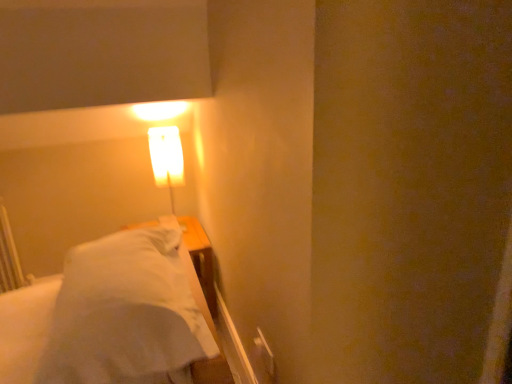
Find the location of a particular element. The width and height of the screenshot is (512, 384). matte white lamp at upper left is located at coordinates (167, 158).

The image size is (512, 384). What do you see at coordinates (167, 158) in the screenshot?
I see `matte white lamp at upper left` at bounding box center [167, 158].

The height and width of the screenshot is (384, 512). Describe the element at coordinates (25, 329) in the screenshot. I see `white soft bed at left` at that location.

This screenshot has width=512, height=384. What are the coordinates of `white soft bed at left` in the screenshot? It's located at (25, 329).

Where is `matte white lamp at upper left`? The image size is (512, 384). matte white lamp at upper left is located at coordinates (167, 158).

Would you say matte white lamp at upper left is to the left or to the right of white soft bed at left in the picture?

Clearly, matte white lamp at upper left is on the left of white soft bed at left in the image.

Considering the positions of objects matte white lamp at upper left and white soft bed at left in the image provided, who is behind, matte white lamp at upper left or white soft bed at left?

matte white lamp at upper left is more distant.

Between point (172, 159) and point (7, 346), which one is positioned in front?

The point (7, 346) is closer to the camera.

In the scene shown: From the image's perspective, does matte white lamp at upper left appear higher than white soft bed at left?

Correct, matte white lamp at upper left appears higher than white soft bed at left in the image.

Consider the image. From a real-world perspective, is matte white lamp at upper left positioned above or below white soft bed at left?

Clearly, from a real-world perspective, matte white lamp at upper left is above white soft bed at left.

Is matte white lamp at upper left wider or thinner than white soft bed at left?

In the image, matte white lamp at upper left appears to be more narrow than white soft bed at left.

Is matte white lamp at upper left taller or shorter than white soft bed at left?

matte white lamp at upper left is taller than white soft bed at left.

Which of these two, matte white lamp at upper left or white soft bed at left, is bigger?

white soft bed at left.

Is matte white lamp at upper left completely or partially outside of white soft bed at left?

Absolutely, matte white lamp at upper left is external to white soft bed at left.

Based on the photo, are matte white lamp at upper left and white soft bed at left far apart?

matte white lamp at upper left is actually quite close to white soft bed at left.

Looking at this image, could you tell me if matte white lamp at upper left is facing white soft bed at left?

No, matte white lamp at upper left is not oriented towards white soft bed at left.

Where is `lamp lying on the left of white soft bed at left`? lamp lying on the left of white soft bed at left is located at coordinates (167, 158).

Does white soft bed at left appear on the left side of matte white lamp at upper left?

Incorrect, white soft bed at left is not on the left side of matte white lamp at upper left.

Is white soft bed at left in front of or behind matte white lamp at upper left in the image?

Visually, white soft bed at left is located in front of matte white lamp at upper left.

Is point (22, 354) positioned in front of point (172, 129)?

Yes, it is.

Consider the image. From the image's perspective, is white soft bed at left on top of matte white lamp at upper left?

No, from the image's perspective, white soft bed at left is not on top of matte white lamp at upper left.

From a real-world perspective, does white soft bed at left sit lower than matte white lamp at upper left?

Yes, from a real-world perspective, white soft bed at left is beneath matte white lamp at upper left.

Which of these two, white soft bed at left or matte white lamp at upper left, is wider?

With larger width is white soft bed at left.

Between white soft bed at left and matte white lamp at upper left, which one has more height?

matte white lamp at upper left is taller.

Between white soft bed at left and matte white lamp at upper left, which one has smaller size?

matte white lamp at upper left.

Is matte white lamp at upper left completely or partially inside white soft bed at left?

No, matte white lamp at upper left is not surrounded by white soft bed at left.

Are white soft bed at left and matte white lamp at upper left beside each other?

No.

Is white soft bed at left positioned with its back to matte white lamp at upper left?

No, white soft bed at left's orientation is not away from matte white lamp at upper left.

At what (x,y) coordinates should I click in order to perform the action: click on bed on the right side of matte white lamp at upper left. Please return your answer as a coordinate pair (x, y). The image size is (512, 384). Looking at the image, I should click on pos(25,329).

Locate an element on the screen. The image size is (512, 384). lamp lying behind the white soft bed at left is located at coordinates (167, 158).

I want to click on bed lying in front of the matte white lamp at upper left, so click(x=25, y=329).